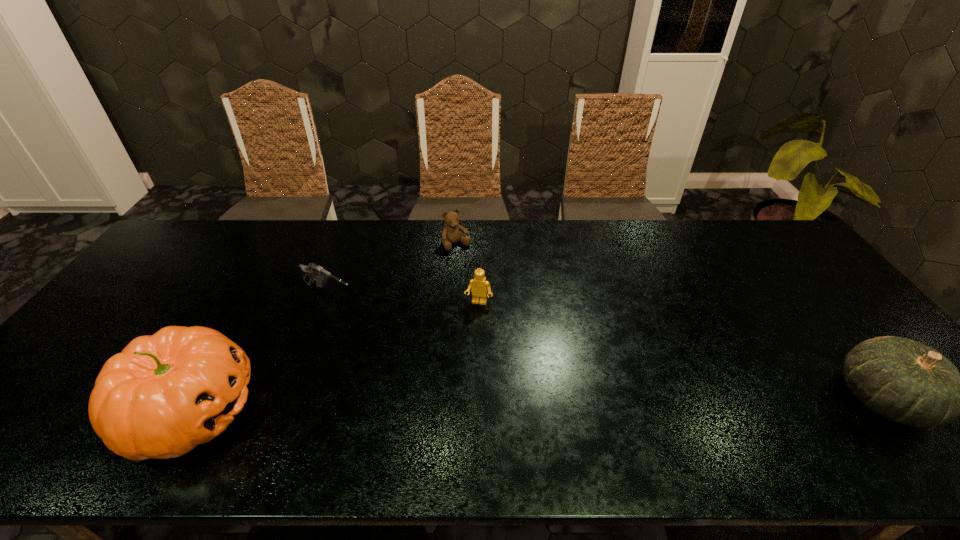
You are a GUI agent. You are given a task and a screenshot of the screen. Output one action in this format:
    pyautogui.click(x=<x>, y=<y>)
    Task: Click on the free space at the far right corner of the desktop
    
    Given the screenshot: What is the action you would take?
    pyautogui.click(x=754, y=246)

Locate an element on the screen. The height and width of the screenshot is (540, 960). vacant area that lies between the farthest object and the gun is located at coordinates tap(393, 271).

Locate an element on the screen. vacant space that is in between the farthest object and the pumpkin is located at coordinates (324, 327).

Locate an element on the screen. The image size is (960, 540). free space that is in between the gun and the Lego is located at coordinates (404, 300).

Identify the location of empty space that is in between the Lego and the teddy bear. The width and height of the screenshot is (960, 540). (468, 273).

Find the location of a particular element. free space between the gun and the Lego is located at coordinates (404, 300).

Identify the location of empty space that is in between the pumpkin and the farthest object. (324, 327).

At what (x,y) coordinates should I click in order to perform the action: click on free spot between the teddy bear and the pumpkin. Please return your answer as a coordinate pair (x, y). Looking at the image, I should click on (324, 327).

Locate which object ranks in proximity to the farthest object. Please provide its 2D coordinates. Your answer should be formatted as a tuple, i.e. [(x, y)], where the tuple contains the x and y coordinates of a point satisfying the conditions above.

[(479, 285)]

Identify which object is the fourth nearest to the pumpkin. Please provide its 2D coordinates. Your answer should be formatted as a tuple, i.e. [(x, y)], where the tuple contains the x and y coordinates of a point satisfying the conditions above.

[(905, 381)]